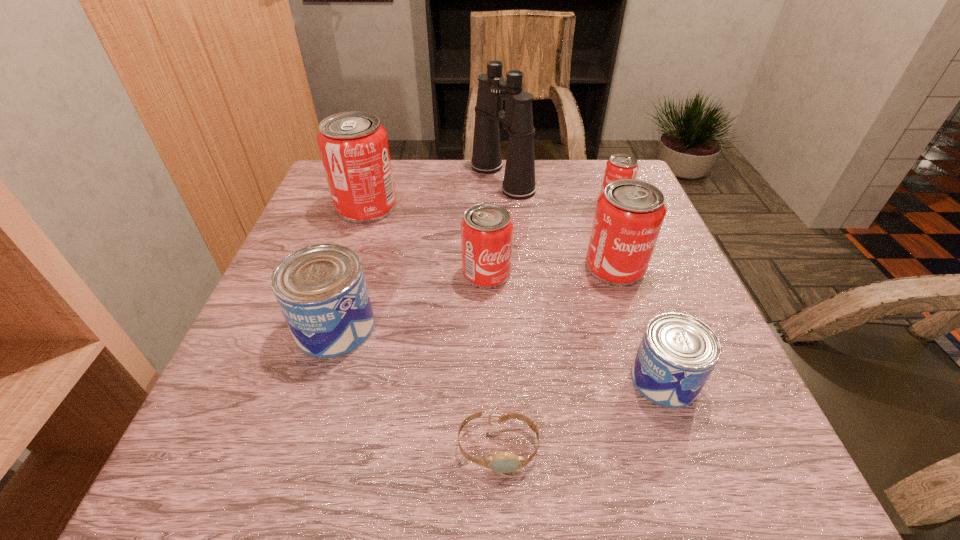
Identify which object is the seventh closest to the tallest object. Please provide its 2D coordinates. Your answer should be formatted as a tuple, i.e. [(x, y)], where the tuple contains the x and y coordinates of a point satisfying the conditions above.

[(505, 462)]

At what (x,y) coordinates should I click in order to perform the action: click on can that stands as the closest to the bigger blue can. Please return your answer as a coordinate pair (x, y). Looking at the image, I should click on (486, 229).

Point out which can is positioned as the fourth nearest to the tallest object. Please provide its 2D coordinates. Your answer should be formatted as a tuple, i.e. [(x, y)], where the tuple contains the x and y coordinates of a point satisfying the conditions above.

[(486, 229)]

Locate which red can is the third closest to the smallest red can. Please provide its 2D coordinates. Your answer should be formatted as a tuple, i.e. [(x, y)], where the tuple contains the x and y coordinates of a point satisfying the conditions above.

[(353, 146)]

Identify which red can is the third closest to the smaller blue can. Please provide its 2D coordinates. Your answer should be formatted as a tuple, i.e. [(x, y)], where the tuple contains the x and y coordinates of a point satisfying the conditions above.

[(620, 166)]

Find the location of `vacant space that satisfies the following two spatial constraints: 1. on the back side of the smallest red can; 2. on the right side of the fourth can from right to left`. vacant space that satisfies the following two spatial constraints: 1. on the back side of the smallest red can; 2. on the right side of the fourth can from right to left is located at coordinates (486, 199).

You are a GUI agent. You are given a task and a screenshot of the screen. Output one action in this format:
    pyautogui.click(x=<x>, y=<y>)
    Task: Click on the free region that satisfies the following two spatial constraints: 1. on the back side of the third smallest red can; 2. on the right side of the fourth can from right to left
    The image size is (960, 540).
    Given the screenshot: What is the action you would take?
    pyautogui.click(x=487, y=267)

Where is `vacant space that satisfies the following two spatial constraints: 1. on the back side of the leftmost red can; 2. on the right side of the smallest red can`? vacant space that satisfies the following two spatial constraints: 1. on the back side of the leftmost red can; 2. on the right side of the smallest red can is located at coordinates (370, 199).

Where is `vacant space that satisfies the following two spatial constraints: 1. on the front label of the right blue can; 2. on the face of the watch`? The image size is (960, 540). vacant space that satisfies the following two spatial constraints: 1. on the front label of the right blue can; 2. on the face of the watch is located at coordinates [x=688, y=447].